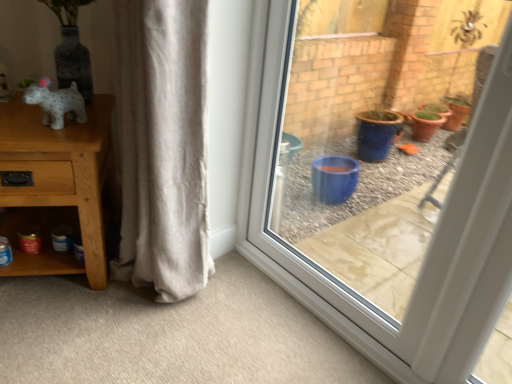
At what (x,y) coordinates should I click in order to perform the action: click on vacant space to the right of speckled white dog at left. Please return your answer as a coordinate pair (x, y). Looking at the image, I should click on (80, 133).